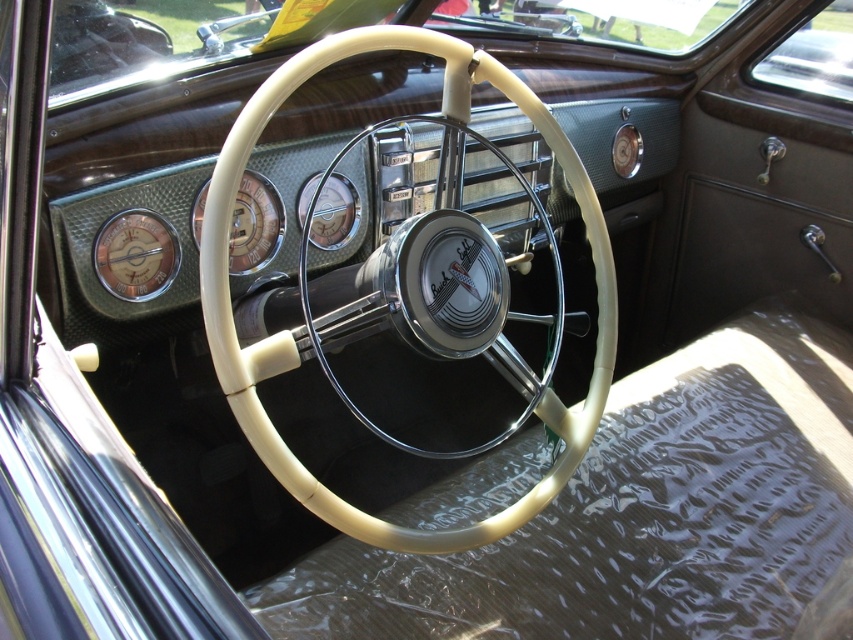
Is creamy white steering wheel at center to the right of matte silver gauge at center left from the viewer's perspective?

Yes, creamy white steering wheel at center is to the right of matte silver gauge at center left.

Identify the location of creamy white steering wheel at center. This screenshot has width=853, height=640. (289, 339).

Where is `creamy white steering wheel at center`? This screenshot has width=853, height=640. creamy white steering wheel at center is located at coordinates (289, 339).